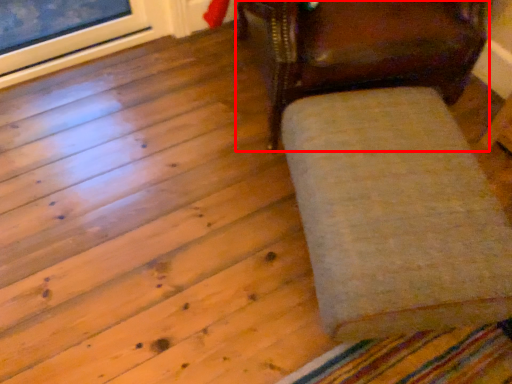
Question: Where is chair (annotated by the red box) located in relation to furniture in the image?

Choices:
 (A) right
 (B) left

Answer: (B)